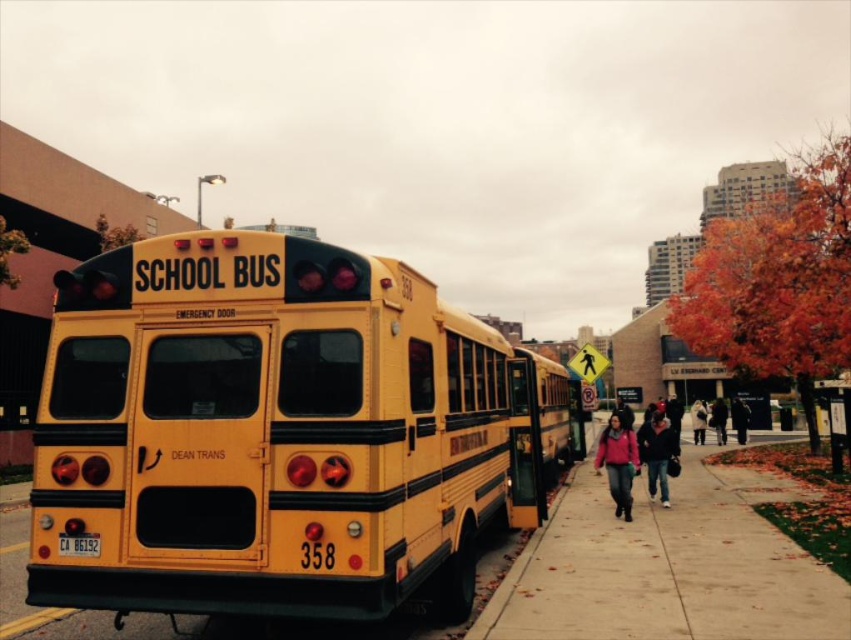
Question: Estimate the real-world distances between objects in this image. Which object is farther from the yellow matte/solid school bus at center?

Choices:
 (A) matte pink jacket at center
 (B) dark blue jacket at center
 (C) dark gray hoodie at center

Answer: (B)

Question: Among these points, which one is nearest to the camera?

Choices:
 (A) (637, 433)
 (B) (627, 451)
 (C) (620, 401)

Answer: (B)

Question: Which object is positioned farthest from the matte black jacket at center?

Choices:
 (A) yellow matte/solid school bus at center
 (B) concrete sidewalk at lower right

Answer: (A)

Question: Is dark gray hoodie at center above dark blue jeans at lower right?

Choices:
 (A) no
 (B) yes

Answer: (B)

Question: Is matte pink jacket at center further to camera compared to dark blue jacket at center?

Choices:
 (A) no
 (B) yes

Answer: (A)

Question: From the image, what is the correct spatial relationship of dark blue jeans at lower right in relation to matte black jacket at center?

Choices:
 (A) below
 (B) above

Answer: (B)